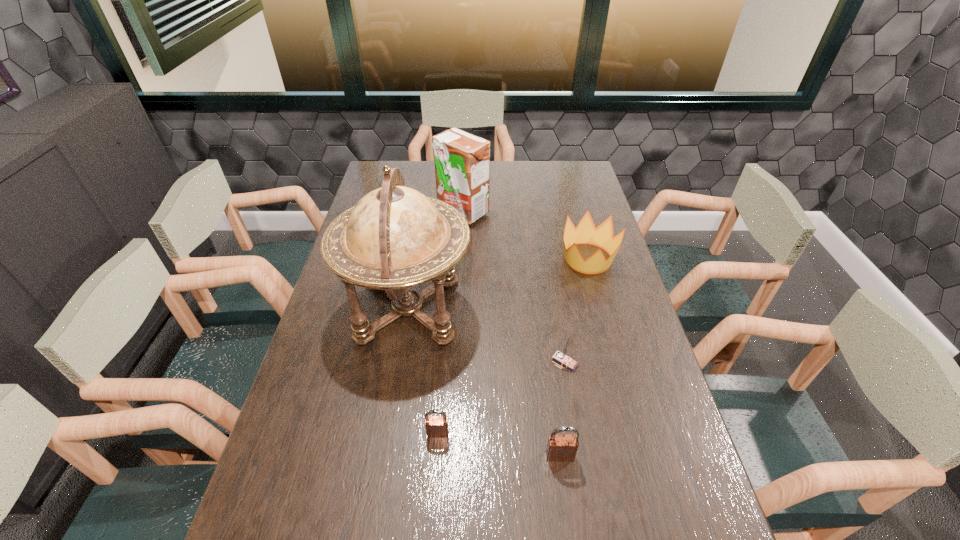
You are a GUI agent. You are given a task and a screenshot of the screen. Output one action in this format:
    pyautogui.click(x=<x>, y=<y>)
    Task: Click on the vacant space that's between the right padlock and the matchbox
    This screenshot has width=960, height=540.
    Given the screenshot: What is the action you would take?
    pyautogui.click(x=563, y=409)

Where is `free spot between the nearest object and the crown`? Image resolution: width=960 pixels, height=540 pixels. free spot between the nearest object and the crown is located at coordinates (574, 357).

The width and height of the screenshot is (960, 540). Identify the location of the closest object relative to the matchbox. (560, 447).

Find the location of `object that can be found as the fourth closest to the globe`. object that can be found as the fourth closest to the globe is located at coordinates (585, 233).

Find the location of a particular element. free region that satisfies the following two spatial constraints: 1. on the front-facing side of the tallest object; 2. on the left side of the matchbox is located at coordinates (399, 362).